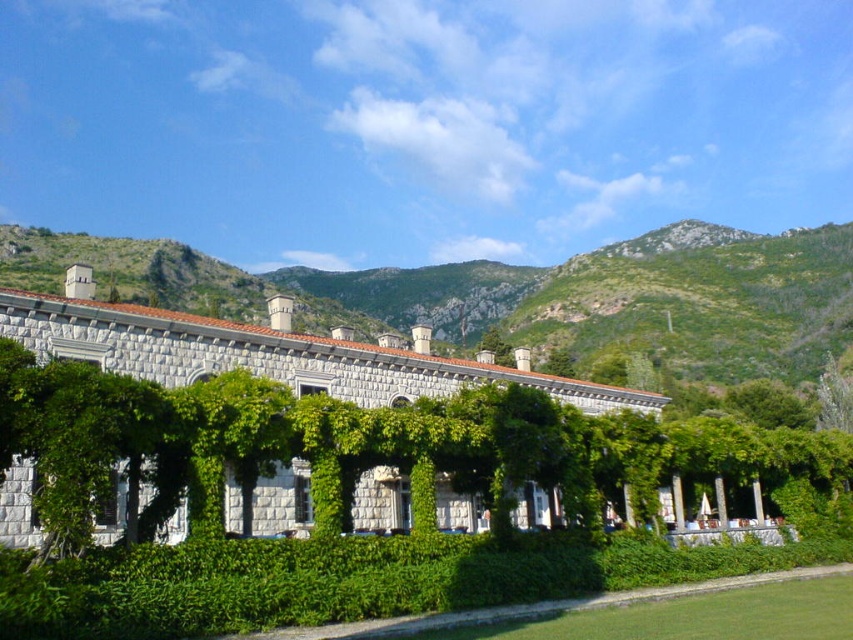
Is point (720, 312) positioned in front of point (732, 394)?

That is False.

Does green grassy hillside at upper center have a greater width compared to green leafy tree at center?

Yes.

Is point (113, 280) positioned before point (755, 381)?

No, (113, 280) is behind (755, 381).

Identify the location of green grassy hillside at upper center. Image resolution: width=853 pixels, height=640 pixels. (521, 294).

Is green ivy hedge at center below green grassy hillside at upper center?

Correct, green ivy hedge at center is located below green grassy hillside at upper center.

Identify the location of green ivy hedge at center. (349, 445).

Locate an element on the screen. The image size is (853, 640). green ivy hedge at center is located at coordinates (349, 445).

Which is more to the left, green ivy hedge at center or green leafy tree at center?

From the viewer's perspective, green ivy hedge at center appears more on the left side.

Does green ivy hedge at center lie behind green leafy tree at center?

No, it is in front of green leafy tree at center.

Where is `green ivy hedge at center`? This screenshot has height=640, width=853. green ivy hedge at center is located at coordinates pos(349,445).